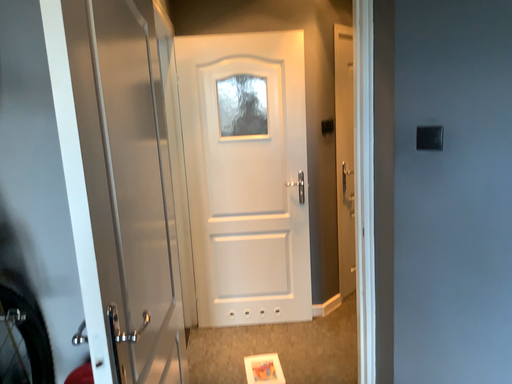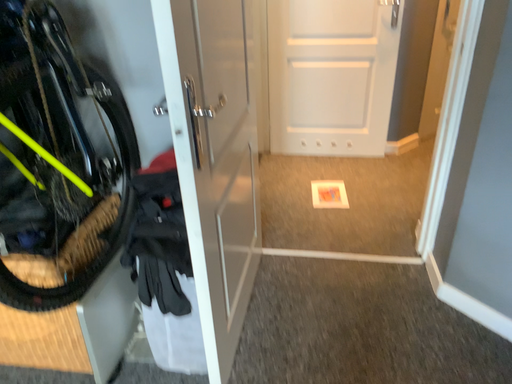
Question: Which way did the camera rotate in the video?

Choices:
 (A) rotated downward
 (B) rotated upward

Answer: (A)